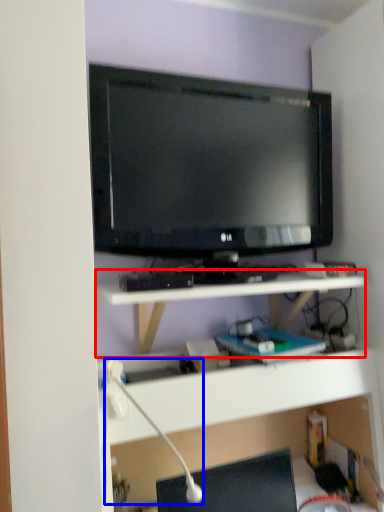
Question: Which of the following is the closest to the observer, shelf (highlighted by a red box) or lamp (highlighted by a blue box)?

Choices:
 (A) shelf
 (B) lamp

Answer: (B)